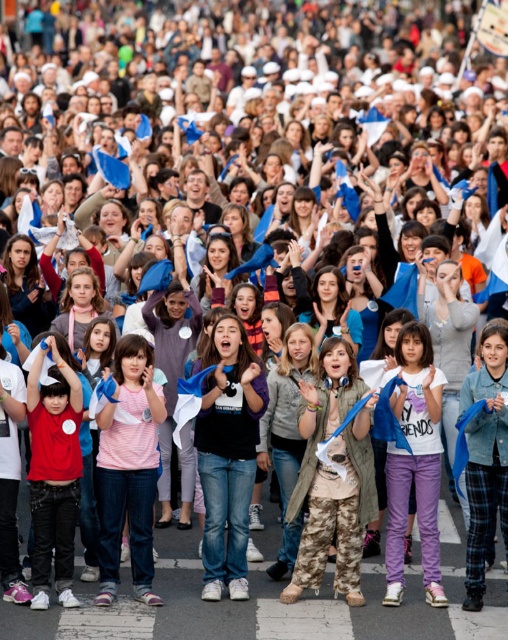
Question: Which object is closer to the camera taking this photo?

Choices:
 (A) camouflage pants at center
 (B) pink fabric shirt at center

Answer: (B)

Question: Can you confirm if camouflage pants at center is wider than pink fabric shirt at center?

Choices:
 (A) no
 (B) yes

Answer: (B)

Question: Based on their relative distances, which object is nearer to the camouflage pants at center?

Choices:
 (A) matte red shirt at left
 (B) pink fabric shirt at center

Answer: (B)

Question: Is the position of camouflage pants at center more distant than that of matte red shirt at left?

Choices:
 (A) no
 (B) yes

Answer: (B)

Question: Is the position of camouflage pants at center more distant than that of pink fabric shirt at center?

Choices:
 (A) no
 (B) yes

Answer: (B)

Question: Which object is the closest to the camouflage pants at center?

Choices:
 (A) pink fabric shirt at center
 (B) matte red shirt at left

Answer: (A)